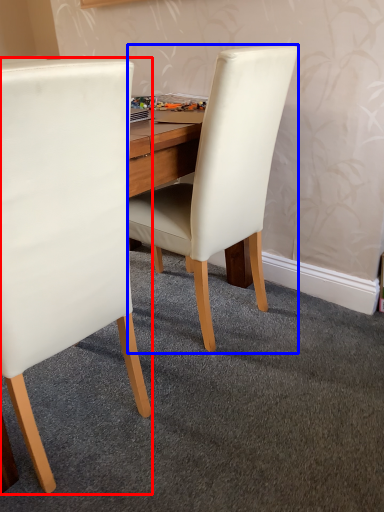
Question: Which object appears closest to the camera in this image, chair (highlighted by a red box) or chair (highlighted by a blue box)?

Choices:
 (A) chair
 (B) chair

Answer: (A)